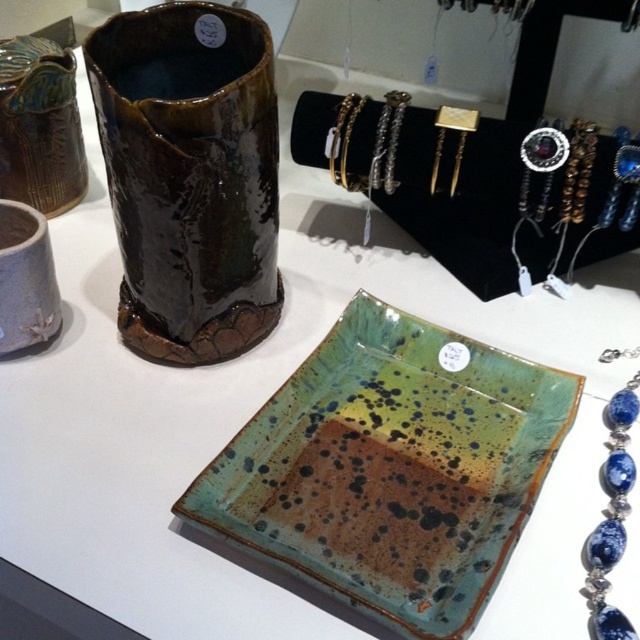
Can you confirm if glossy ceramic vase at upper center is thinner than gold metallic bracelet at upper center?

Incorrect, glossy ceramic vase at upper center's width is not less than gold metallic bracelet at upper center's.

Does point (236, 160) lie in front of point (326, 145)?

Yes.

Identify the location of glossy ceramic vase at upper center. Image resolution: width=640 pixels, height=640 pixels. (189, 177).

Can you confirm if matte clay cup at left is taller than gold metallic bracelet at upper center?

Indeed, matte clay cup at left has a greater height compared to gold metallic bracelet at upper center.

Between matte clay cup at left and gold metallic bracelet at upper center, which one is positioned lower?

matte clay cup at left

You are a GUI agent. You are given a task and a screenshot of the screen. Output one action in this format:
    pyautogui.click(x=<x>, y=<y>)
    Task: Click on the matte clay cup at left
    The image size is (640, 640).
    Given the screenshot: What is the action you would take?
    pyautogui.click(x=26, y=278)

The width and height of the screenshot is (640, 640). Identify the location of matte brown vase at left. [38, 125].

Based on the photo, who is more forward, (74, 131) or (33, 209)?

Point (33, 209) is in front.

Measure the distance between point (65,124) and camera.

Point (65,124) is 1.31 meters away from camera.

Where is `matte brown vase at left`? The image size is (640, 640). matte brown vase at left is located at coordinates (38, 125).